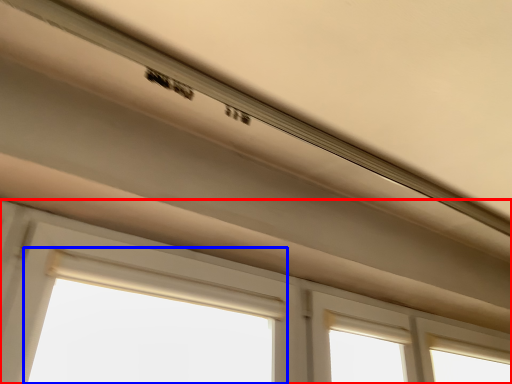
Question: Among these objects, which one is farthest to the camera, window (highlighted by a red box) or bay window (highlighted by a blue box)?

Choices:
 (A) window
 (B) bay window

Answer: (B)